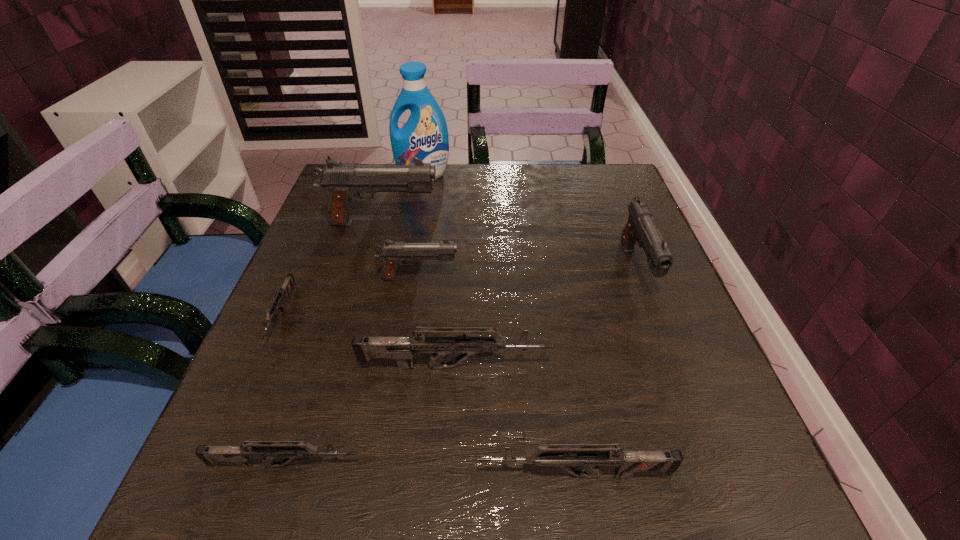
The width and height of the screenshot is (960, 540). Identify the location of free spot located aimed along the barrel of the third smallest grey gun. (443, 475).

Locate an element on the screen. The width and height of the screenshot is (960, 540). vacant space located 0.280m aimed along the barrel of the third smallest grey gun is located at coordinates (279, 475).

At what (x,y) coordinates should I click in order to perform the action: click on vacant position located aimed along the barrel of the third smallest grey gun. Please return your answer as a coordinate pair (x, y). This screenshot has height=540, width=960. Looking at the image, I should click on (222, 475).

Find the location of a particular element. vacant space situated aimed along the barrel of the third biggest grey gun is located at coordinates [x=619, y=465].

Where is `free location located aimed along the barrel of the shortest gun`? The image size is (960, 540). free location located aimed along the barrel of the shortest gun is located at coordinates (232, 428).

Locate an element on the screen. object present at the far edge is located at coordinates (425, 136).

The image size is (960, 540). What are the coordinates of `detergent positioned at the left edge` in the screenshot? It's located at (425, 136).

You are a GUI agent. You are given a task and a screenshot of the screen. Output one action in this format:
    pyautogui.click(x=<x>, y=<y>)
    Task: Click on the object that is at the far left corner
    The height and width of the screenshot is (540, 960).
    Given the screenshot: What is the action you would take?
    pyautogui.click(x=425, y=136)

Locate an element on the screen. Image resolution: width=960 pixels, height=540 pixels. object positioned at the near left corner is located at coordinates (268, 450).

Where is `object positioned at the near right corner`? object positioned at the near right corner is located at coordinates (564, 457).